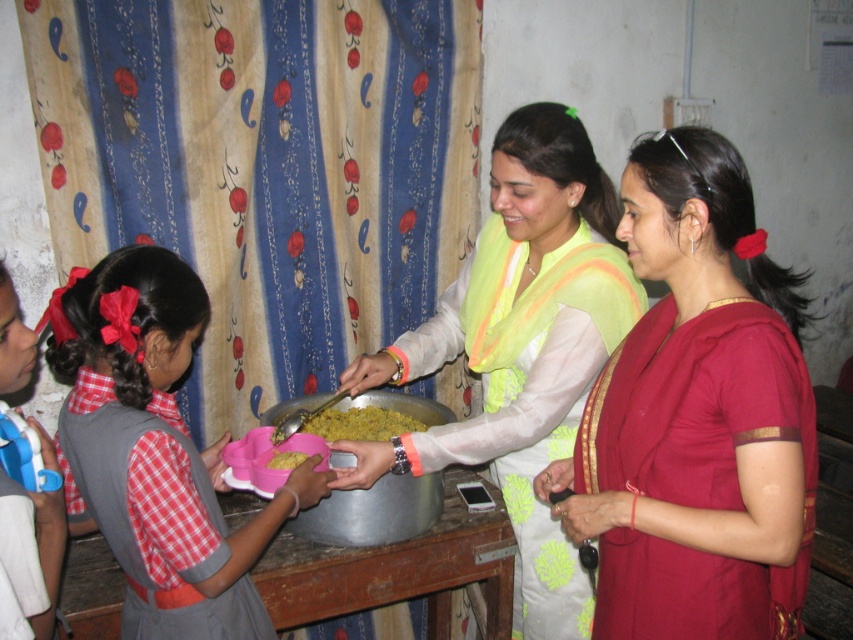
Question: Estimate the real-world distances between objects in this image. Which object is closer to the yellow matte food at center?

Choices:
 (A) pink plastic tray at center
 (B) light green silk saree at center
 (C) yellow matte rice at center

Answer: (C)

Question: Which is nearer to the red plaid dress at lower left?

Choices:
 (A) yellow matte food at center
 (B) light green silk saree at center
 (C) yellow matte rice at center
 (D) pink plastic tray at center

Answer: (D)

Question: Does light green silk saree at center appear under yellow matte food at center?

Choices:
 (A) yes
 (B) no

Answer: (B)

Question: In this image, where is maroon silk saree at center located relative to red plaid dress at lower left?

Choices:
 (A) right
 (B) left

Answer: (A)

Question: Which point is closer to the camera?

Choices:
 (A) (334, 538)
 (B) (210, 518)
 (C) (277, 456)

Answer: (B)

Question: Can you confirm if light green silk saree at center is positioned to the left of red plaid dress at lower left?

Choices:
 (A) yes
 (B) no

Answer: (B)